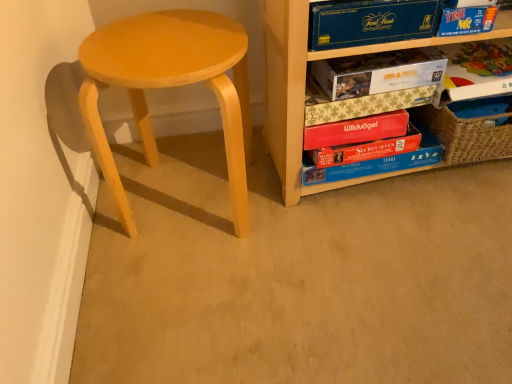
Locate an element on the screen. The height and width of the screenshot is (384, 512). empty space that is to the right of blue cardboard puzzle box at center, placed as the first paperback book when sorted from bottom to top is located at coordinates (459, 196).